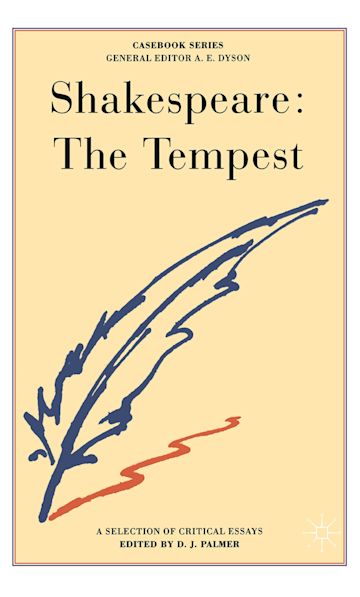
Where is `border of book cover`? The image size is (360, 597). border of book cover is located at coordinates (13, 538).